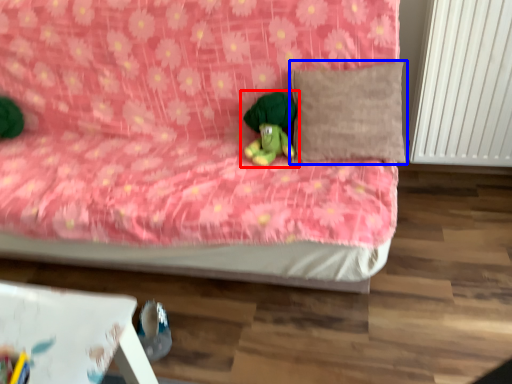
Question: Which object is further to the camera taking this photo, toy (highlighted by a red box) or pillow (highlighted by a blue box)?

Choices:
 (A) toy
 (B) pillow

Answer: (A)